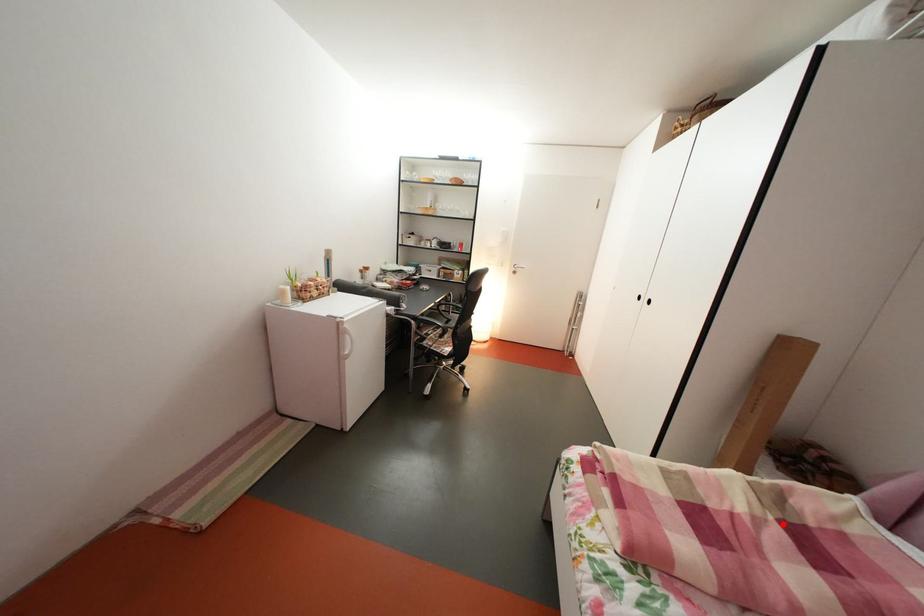
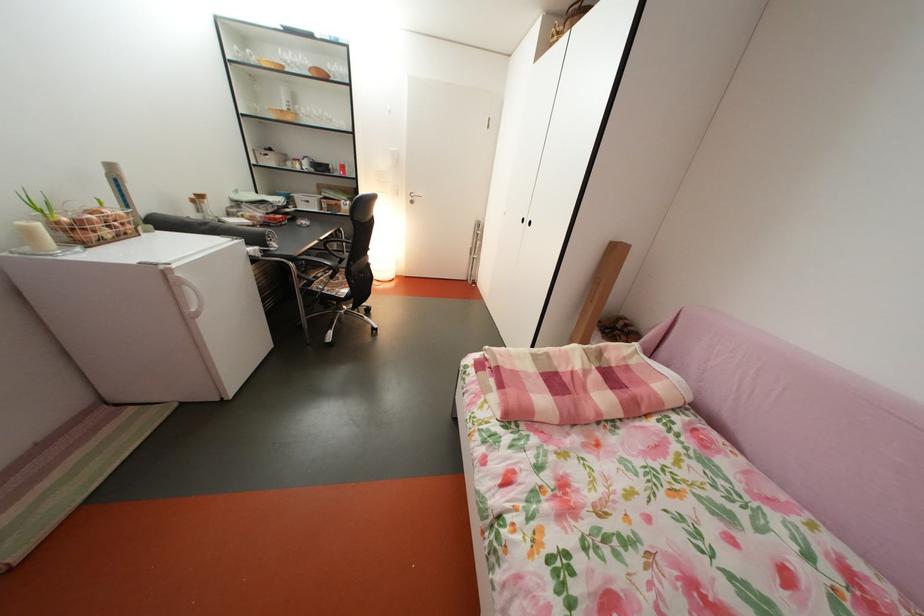
Question: I am providing you with two images of the same scene from different viewpoints. A red point is marked on the first image. Is the red point's position out of view in image 2?

Choices:
 (A) Yes
 (B) No

Answer: (B)